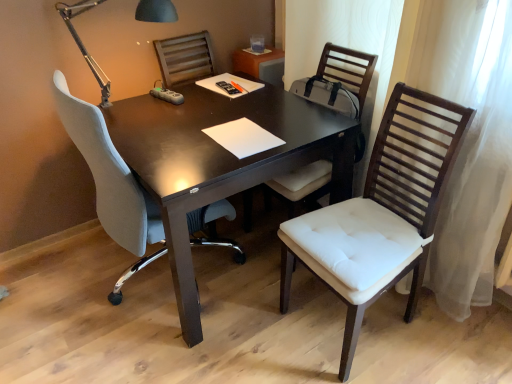
Question: Does matte black table lamp at upper left touch white fabric chair at left, which is the 1th chair from left to right?

Choices:
 (A) yes
 (B) no

Answer: (B)

Question: Does matte black table lamp at upper left come behind white fabric chair at left, the 3th chair when ordered from right to left?

Choices:
 (A) yes
 (B) no

Answer: (A)

Question: Considering the relative sizes of matte black table lamp at upper left and white fabric chair at left, which is the 1th chair from left to right, in the image provided, is matte black table lamp at upper left smaller than white fabric chair at left, which is the 1th chair from left to right,?

Choices:
 (A) yes
 (B) no

Answer: (A)

Question: Is matte black table lamp at upper left facing towards white fabric chair at left, which is the 1th chair from left to right?

Choices:
 (A) no
 (B) yes

Answer: (B)

Question: From the image's perspective, is matte black table lamp at upper left beneath white fabric chair at left, which is the 1th chair from left to right?

Choices:
 (A) yes
 (B) no

Answer: (B)

Question: Relative to dark wood table at center, is white padded chair at right, the 3th chair from the left, in front or behind?

Choices:
 (A) front
 (B) behind

Answer: (A)

Question: Is white padded chair at right, which is the 1th chair in right-to-left order, to the left or to the right of dark wood table at center in the image?

Choices:
 (A) left
 (B) right

Answer: (B)

Question: Is white padded chair at right, the 3th chair from the left, wider or thinner than dark wood table at center?

Choices:
 (A) thin
 (B) wide

Answer: (A)

Question: From a real-world perspective, is white padded chair at right, which is the 1th chair in right-to-left order, positioned above or below dark wood table at center?

Choices:
 (A) below
 (B) above

Answer: (B)

Question: From a real-world perspective, is white padded chair at right, the 3th chair from the left, positioned above or below white paper at center?

Choices:
 (A) below
 (B) above

Answer: (A)

Question: From the image's perspective, is white padded chair at right, which is the 1th chair in right-to-left order, positioned above or below white paper at center?

Choices:
 (A) above
 (B) below

Answer: (B)

Question: Considering their positions, is white padded chair at right, the 3th chair from the left, located in front of or behind white paper at center?

Choices:
 (A) front
 (B) behind

Answer: (A)

Question: Considering the positions of white padded chair at right, the 3th chair from the left, and white paper at center in the image, is white padded chair at right, the 3th chair from the left, wider or thinner than white paper at center?

Choices:
 (A) wide
 (B) thin

Answer: (A)

Question: Does point 167,0 appear closer or farther from the camera than point 356,304?

Choices:
 (A) closer
 (B) farther

Answer: (B)

Question: Choose the correct answer: Is matte black table lamp at upper left inside white padded chair at right, the 3th chair from the left, or outside it?

Choices:
 (A) outside
 (B) inside

Answer: (A)